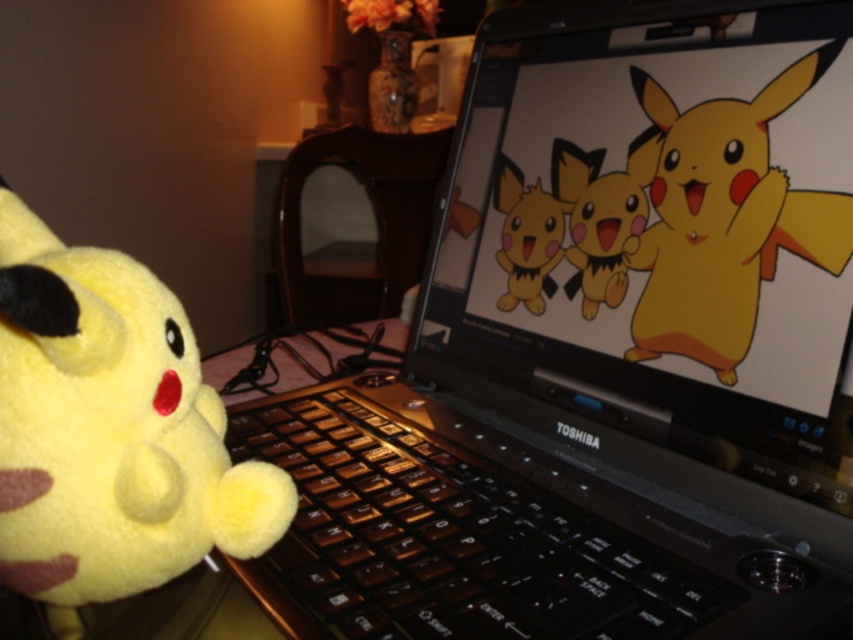
You are holding a 12 inch ruler and want to measure the distance between yourself and the point at coordinates (619, 570) in the image. Can you reach it without moving your hand?

The point at coordinates (619, 570) is 13.46 inches away from the viewer. Since the ruler is only 12 inches long, you cannot reach it without moving your hand.

Looking at this image, you are organizing a desk and have a brown matte keyboard at center and a yellow plush toy at center. Which item takes up more horizontal space on the desk?

The brown matte keyboard at center has a larger width than the yellow plush toy at center, so it takes up more horizontal space on the desk.

You are organizing a study area and need to place the brown matte keyboard at center and the yellow plush toy at center. According to the scene, where should you position them relative to each other?

The brown matte keyboard at center should be placed to the left of the yellow plush toy at center as per the scene description.